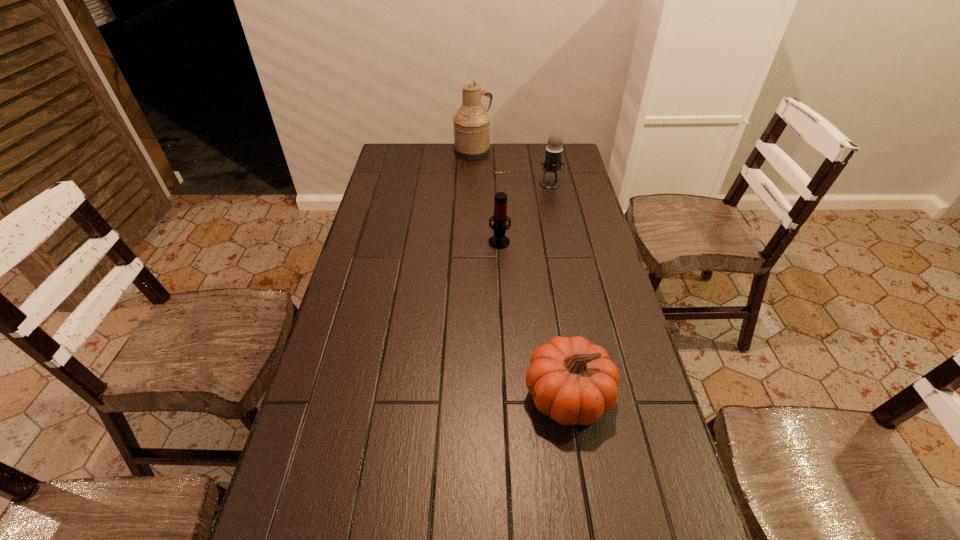
This screenshot has height=540, width=960. Find the location of `vacant space at the far right corner of the desktop`. vacant space at the far right corner of the desktop is located at coordinates (573, 148).

Image resolution: width=960 pixels, height=540 pixels. Identify the location of free point between the pitcher and the nearer microphone. (486, 196).

Image resolution: width=960 pixels, height=540 pixels. Identify the location of free space between the right microphone and the tallest object. (512, 167).

The height and width of the screenshot is (540, 960). I want to click on vacant area that lies between the nearer microphone and the farthest object, so click(486, 196).

At what (x,y) coordinates should I click in order to perform the action: click on empty space that is in between the second nearest object and the nearest object. Please return your answer as a coordinate pair (x, y). The image size is (960, 540). Looking at the image, I should click on (534, 318).

This screenshot has width=960, height=540. Find the location of `empty location between the nearest object and the farther microphone`. empty location between the nearest object and the farther microphone is located at coordinates (559, 289).

Find the location of a particular element. The width and height of the screenshot is (960, 540). unoccupied position between the nearest object and the tallest object is located at coordinates (520, 274).

The image size is (960, 540). Find the location of `free spot between the nearer microphone and the pitcher`. free spot between the nearer microphone and the pitcher is located at coordinates (486, 196).

At what (x,y) coordinates should I click in order to perform the action: click on unoccupied area between the tallest object and the third farthest object. Please return your answer as a coordinate pair (x, y). This screenshot has height=540, width=960. Looking at the image, I should click on (486, 196).

Locate an element on the screen. object that stands as the second closest to the pitcher is located at coordinates (499, 241).